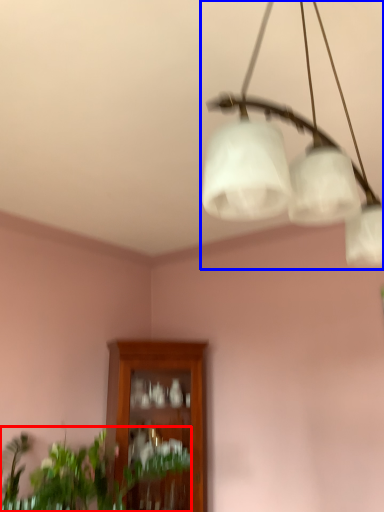
Question: Which object appears farthest to the camera in this image, houseplant (highlighted by a red box) or lamp (highlighted by a blue box)?

Choices:
 (A) houseplant
 (B) lamp

Answer: (A)